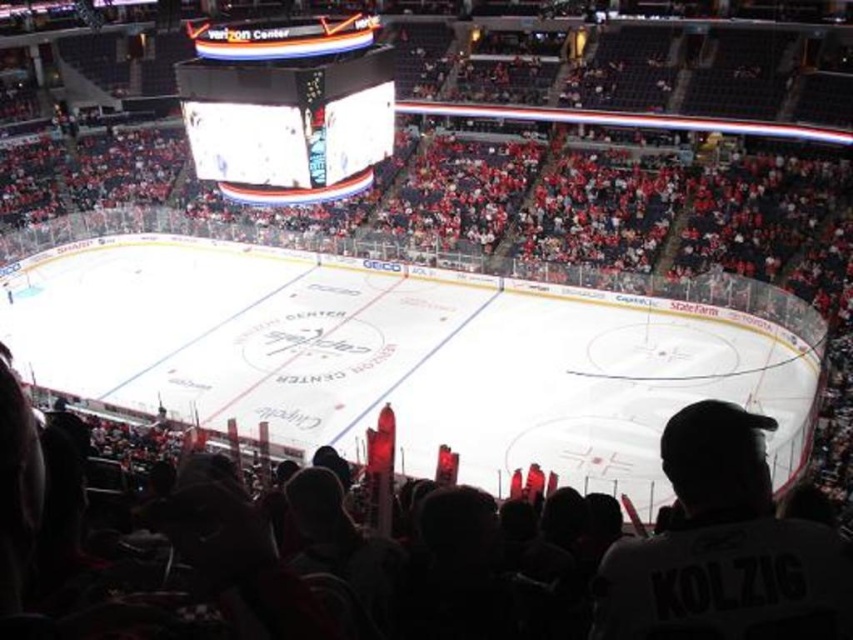
Does white jersey at lower right have a greater width compared to white led scoreboard at upper center?

In fact, white jersey at lower right might be narrower than white led scoreboard at upper center.

Can you confirm if white jersey at lower right is smaller than white led scoreboard at upper center?

Yes.

Between point (718, 552) and point (210, 77), which one is positioned in front?

Positioned in front is point (718, 552).

Identify the location of white jersey at lower right. This screenshot has width=853, height=640. (724, 548).